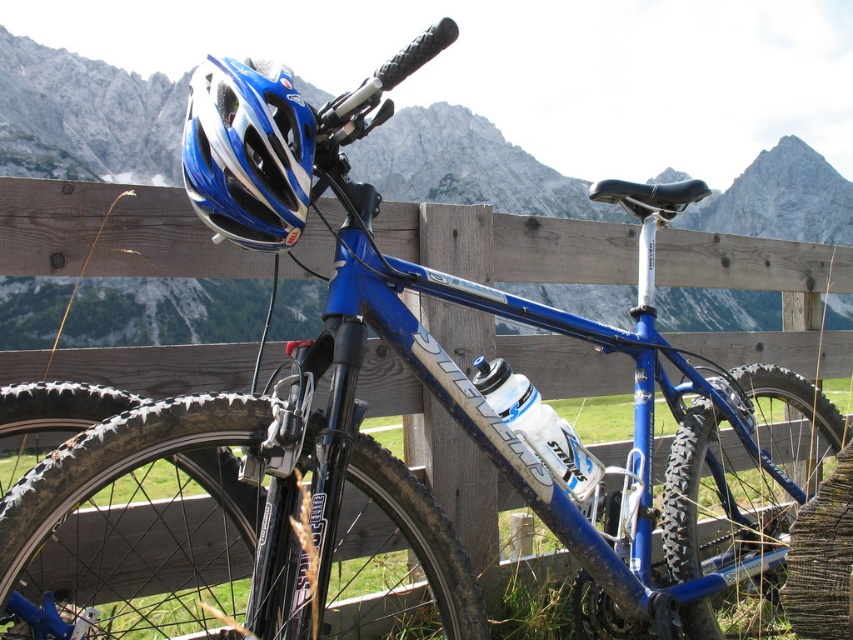
Is blue glossy helmet at upper left to the left of white glossy water bottle at center from the viewer's perspective?

Correct, you'll find blue glossy helmet at upper left to the left of white glossy water bottle at center.

What do you see at coordinates (247, 152) in the screenshot? The height and width of the screenshot is (640, 853). I see `blue glossy helmet at upper left` at bounding box center [247, 152].

Identify the location of blue glossy helmet at upper left. (247, 152).